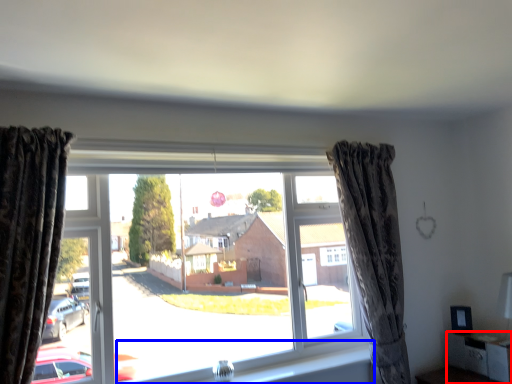
Question: Which object is further to the camera taking this photo, furniture (highlighted by a red box) or window sill (highlighted by a blue box)?

Choices:
 (A) furniture
 (B) window sill

Answer: (A)